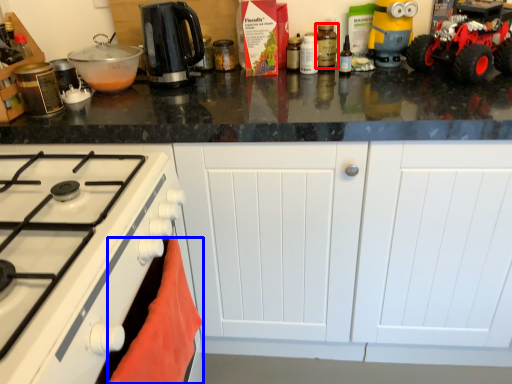
Question: Which object is closer to the camera taking this photo, kitchen appliance (highlighted by a red box) or material (highlighted by a blue box)?

Choices:
 (A) kitchen appliance
 (B) material

Answer: (B)